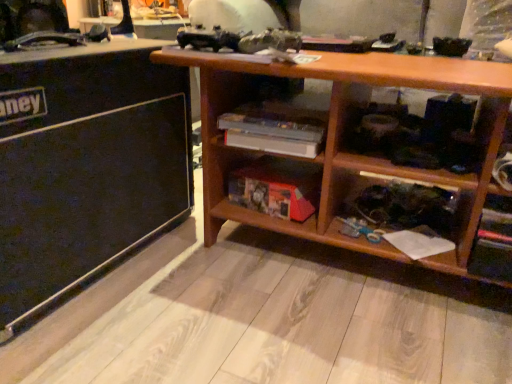
Question: Is wooden shelf at center to the right of black matte speaker at left from the viewer's perspective?

Choices:
 (A) no
 (B) yes

Answer: (B)

Question: Is wooden shelf at center looking in the opposite direction of black matte speaker at left?

Choices:
 (A) yes
 (B) no

Answer: (B)

Question: Is wooden shelf at center oriented towards black matte speaker at left?

Choices:
 (A) yes
 (B) no

Answer: (B)

Question: Is wooden shelf at center wider than black matte speaker at left?

Choices:
 (A) yes
 (B) no

Answer: (B)

Question: Can you confirm if wooden shelf at center is taller than black matte speaker at left?

Choices:
 (A) no
 (B) yes

Answer: (A)

Question: Is wooden shelf at center next to black matte speaker at left and touching it?

Choices:
 (A) yes
 (B) no

Answer: (B)

Question: Is wooden bookshelf at lower center facing away from wooden shelf at center?

Choices:
 (A) no
 (B) yes

Answer: (A)

Question: From the image's perspective, is wooden bookshelf at lower center over wooden shelf at center?

Choices:
 (A) no
 (B) yes

Answer: (A)

Question: From a real-world perspective, does wooden bookshelf at lower center stand above wooden shelf at center?

Choices:
 (A) yes
 (B) no

Answer: (B)

Question: Is wooden shelf at center completely or partially inside wooden bookshelf at lower center?

Choices:
 (A) yes
 (B) no

Answer: (B)

Question: Is wooden bookshelf at lower center not close to wooden shelf at center?

Choices:
 (A) no
 (B) yes

Answer: (A)

Question: Does wooden bookshelf at lower center turn towards wooden shelf at center?

Choices:
 (A) yes
 (B) no

Answer: (B)

Question: Could you tell me if black matte speaker at left is turned towards wooden bookshelf at lower center?

Choices:
 (A) yes
 (B) no

Answer: (A)